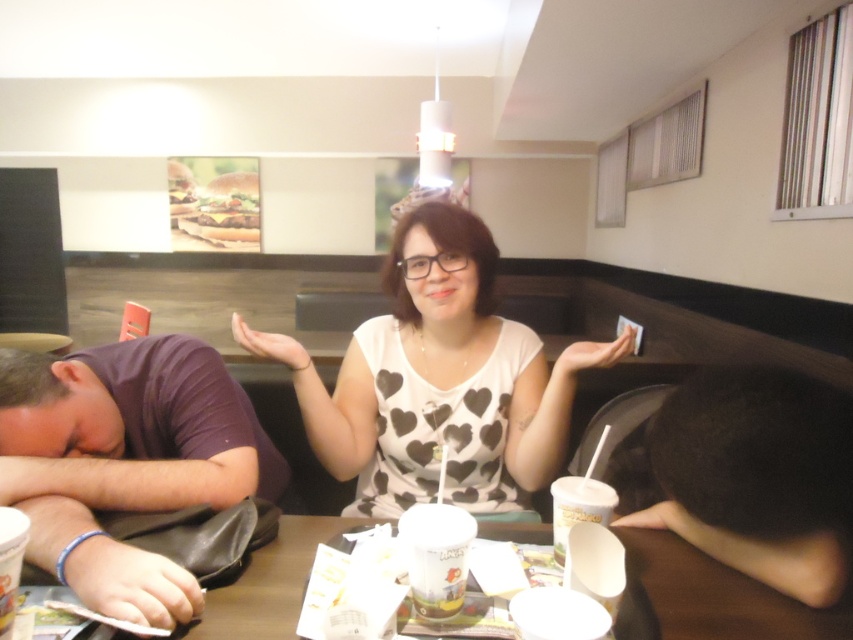
You are a server in a fast food restaurant and need to place a new drink order on the table. The table currently has a purple fabric shirt at left and a white paper cup at lower center. Will the new drink fit between them if it is 12 centimeters wide?

The purple fabric shirt at left might be wider than white paper cup at lower center, so the space between them may not be sufficient for a drink that is 12 centimeters wide. Check the actual distance before placing the drink.

You are a customer sitting at the table and need to place your phone on the purple fabric shirt at left or the brown paper table at center. Which surface can accommodate a phone of 12 cm in width?

The brown paper table at center can accommodate a phone of 12 cm in width since its width is greater than the purple fabric shirt at left.